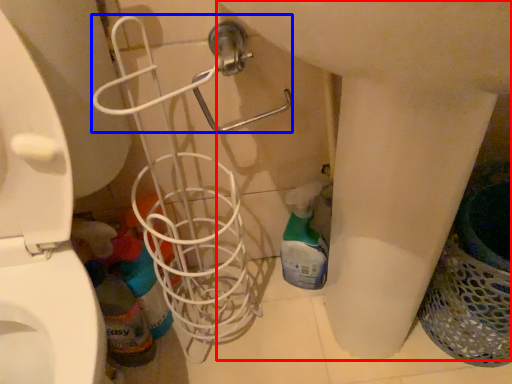
Question: Which point is further to the camera, sink (highlighted by a red box) or shower (highlighted by a blue box)?

Choices:
 (A) sink
 (B) shower

Answer: (B)